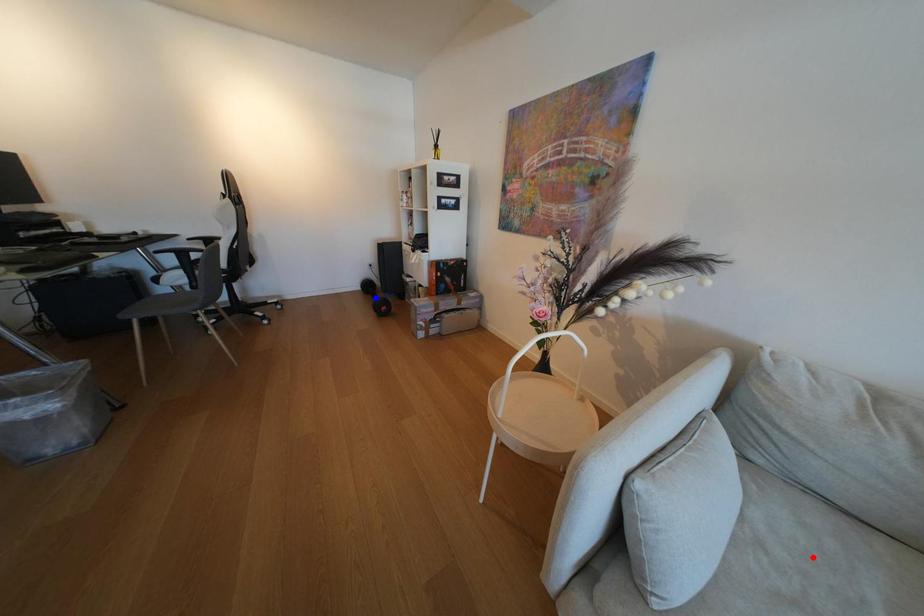
Question: Two points are marked on the image. Which point is closer to the camera?

Choices:
 (A) Blue point is closer.
 (B) Red point is closer.

Answer: (B)